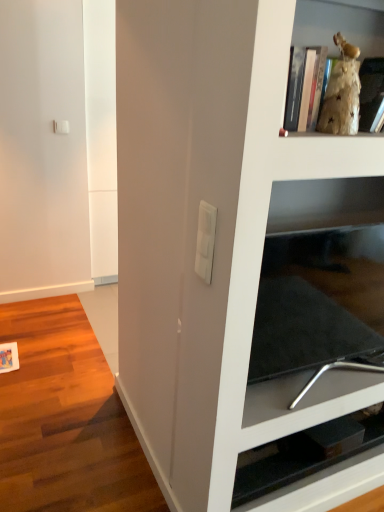
Question: Is the depth of gold textured figurine at upper right, the second shelf ordered from the bottom, greater than that of black glossy tv stand at lower right, the 2th shelf when ordered from top to bottom?

Choices:
 (A) no
 (B) yes

Answer: (A)

Question: Can we say gold textured figurine at upper right, placed as the first shelf when sorted from top to bottom, lies outside black glossy tv stand at lower right, the 2th shelf when ordered from top to bottom?

Choices:
 (A) yes
 (B) no

Answer: (A)

Question: Can you confirm if gold textured figurine at upper right, the second shelf ordered from the bottom, is shorter than black glossy tv stand at lower right, the second shelf from the front?

Choices:
 (A) no
 (B) yes

Answer: (A)

Question: From the image's perspective, is gold textured figurine at upper right, the second shelf ordered from the bottom, under black glossy tv stand at lower right, marked as the first shelf in a bottom-to-top arrangement?

Choices:
 (A) yes
 (B) no

Answer: (B)

Question: Is gold textured figurine at upper right, the second shelf ordered from the bottom, positioned far away from black glossy tv stand at lower right, the second shelf from the front?

Choices:
 (A) yes
 (B) no

Answer: (A)

Question: Which is correct: gold textured figurine at upper right, the second shelf ordered from the bottom, is inside white plastic light switch at center, or outside of it?

Choices:
 (A) outside
 (B) inside

Answer: (A)

Question: From a real-world perspective, is gold textured figurine at upper right, which appears as the 1th shelf when viewed from the front, physically located above or below white plastic light switch at center?

Choices:
 (A) below
 (B) above

Answer: (B)

Question: In terms of height, does gold textured figurine at upper right, the second shelf from the back, look taller or shorter compared to white plastic light switch at center?

Choices:
 (A) tall
 (B) short

Answer: (A)

Question: Is point (372, 51) closer or farther from the camera than point (210, 247)?

Choices:
 (A) farther
 (B) closer

Answer: (A)

Question: Considering the relative positions of white plastic light switch at center and black glossy tv stand at lower right, the 2th shelf when ordered from top to bottom, in the image provided, is white plastic light switch at center to the left or to the right of black glossy tv stand at lower right, the 2th shelf when ordered from top to bottom,?

Choices:
 (A) right
 (B) left

Answer: (B)

Question: Choose the correct answer: Is white plastic light switch at center inside black glossy tv stand at lower right, the second shelf from the front, or outside it?

Choices:
 (A) outside
 (B) inside

Answer: (A)

Question: Looking at their shapes, would you say white plastic light switch at center is wider or thinner than black glossy tv stand at lower right, the second shelf from the front?

Choices:
 (A) thin
 (B) wide

Answer: (A)

Question: From the image's perspective, is white plastic light switch at center positioned above or below black glossy tv stand at lower right, marked as the first shelf in a bottom-to-top arrangement?

Choices:
 (A) above
 (B) below

Answer: (A)

Question: Would you say black glossy tv stand at lower right, the 2th shelf when ordered from top to bottom, is inside or outside white plastic light switch at center?

Choices:
 (A) outside
 (B) inside

Answer: (A)

Question: From a real-world perspective, is black glossy tv stand at lower right, the second shelf from the front, above or below white plastic light switch at center?

Choices:
 (A) above
 (B) below

Answer: (B)